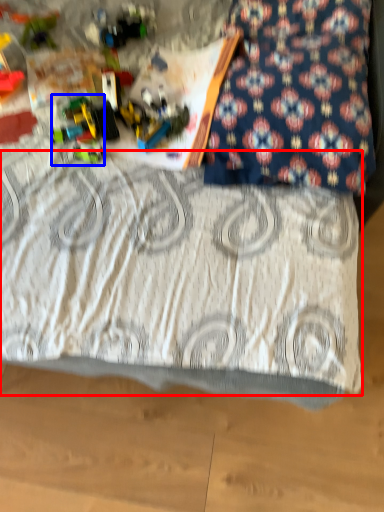
Question: Which object appears closest to the camera in this image, bedding (highlighted by a red box) or toy (highlighted by a blue box)?

Choices:
 (A) bedding
 (B) toy

Answer: (A)